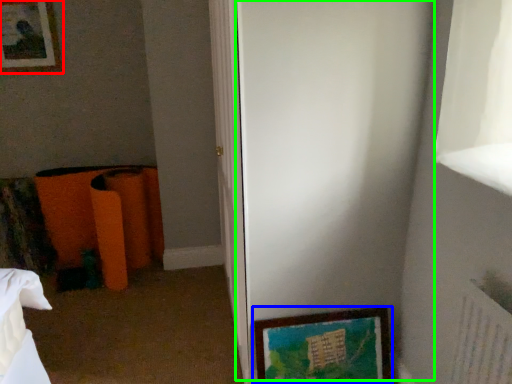
Question: Which is nearer to the picture frame (highlighted by a red box)? picture frame (highlighted by a blue box) or screen door (highlighted by a green box).

Choices:
 (A) picture frame
 (B) screen door

Answer: (B)